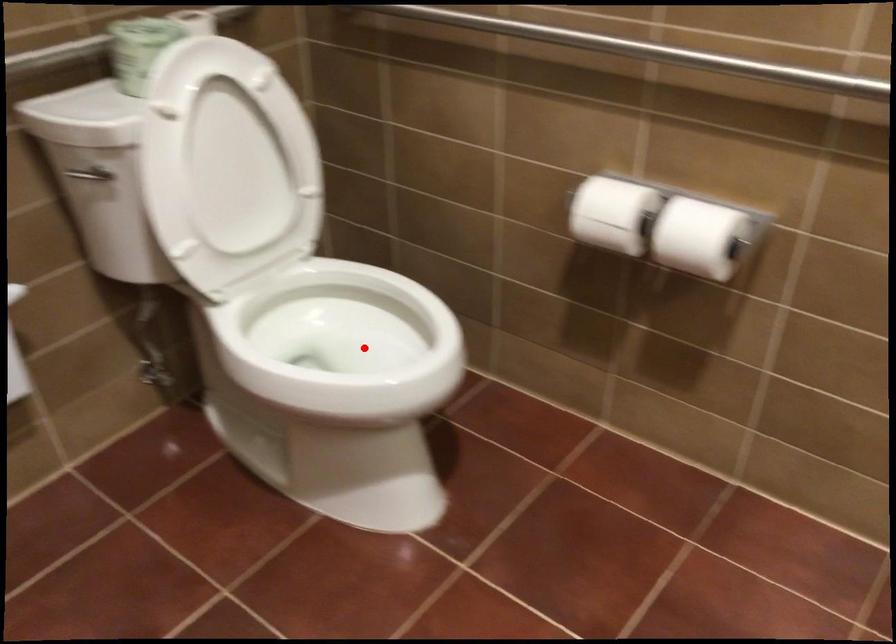
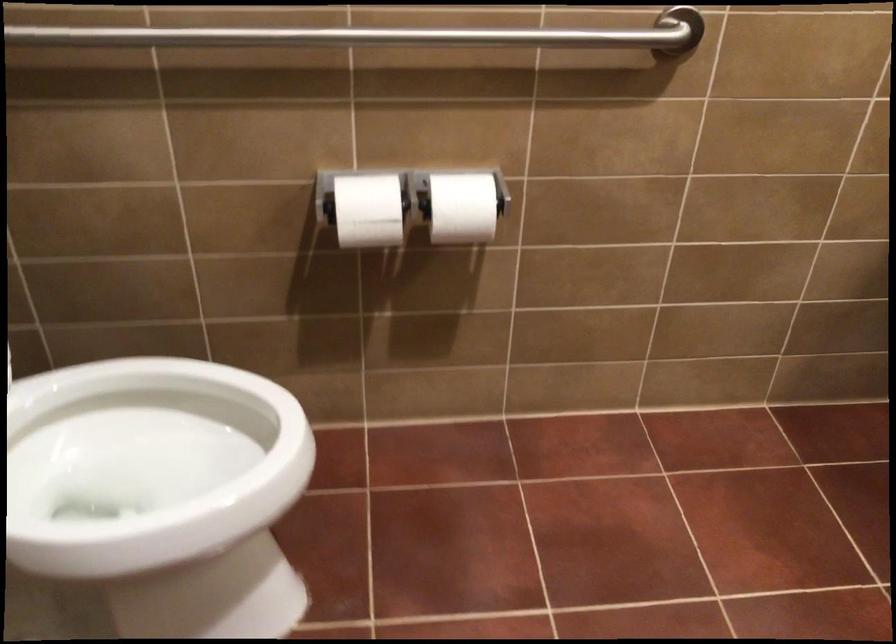
Question: I am providing you with two images of the same scene from different viewpoints. Given a red point in image1, look at the same physical point in image2. Is it:

Choices:
 (A) Closer to the viewpoint
 (B) Farther from the viewpoint

Answer: (A)